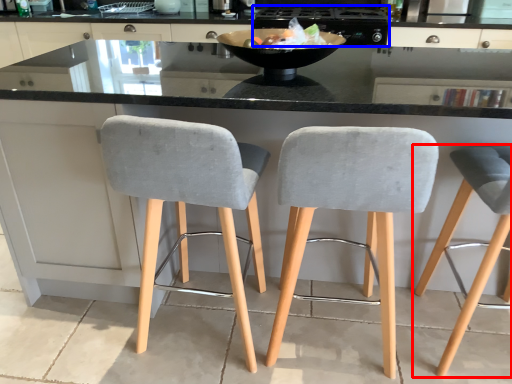
Question: Which point is closer to the camera, chair (highlighted by a red box) or appliance (highlighted by a blue box)?

Choices:
 (A) chair
 (B) appliance

Answer: (A)